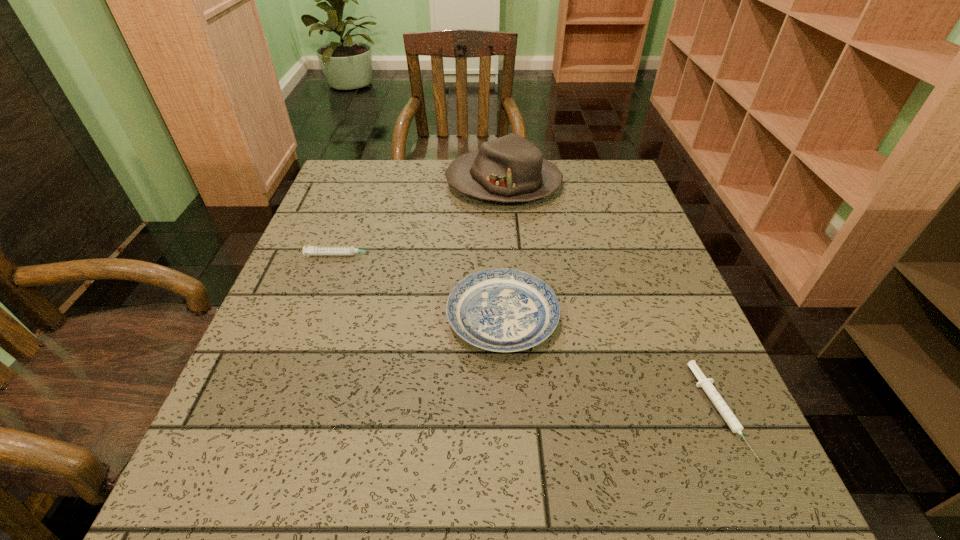
The height and width of the screenshot is (540, 960). In the image, there is a desktop. Find the location of `vacant space at the near edge`. vacant space at the near edge is located at coordinates (553, 509).

This screenshot has height=540, width=960. What are the coordinates of `free region at the left edge` in the screenshot? It's located at (273, 312).

Image resolution: width=960 pixels, height=540 pixels. Find the location of `vacant space at the right edge of the desktop`. vacant space at the right edge of the desktop is located at coordinates (674, 357).

The image size is (960, 540). In the image, there is a desktop. In order to click on free region at the far left corner in this screenshot , I will do `click(359, 181)`.

The image size is (960, 540). What are the coordinates of `vacant space at the near left corner of the desktop` in the screenshot? It's located at (215, 520).

Identify the location of vacant space at the far right corner of the desktop. Image resolution: width=960 pixels, height=540 pixels. (598, 201).

The image size is (960, 540). Find the location of `free space between the second tallest object and the shorter syringe`. free space between the second tallest object and the shorter syringe is located at coordinates (610, 363).

I want to click on empty location between the nearer syringe and the second tallest object, so click(x=610, y=363).

Find the location of a particular element. This screenshot has height=540, width=960. vacant area between the third farthest object and the farther syringe is located at coordinates (422, 286).

I want to click on free space between the second tallest object and the shortest object, so click(610, 363).